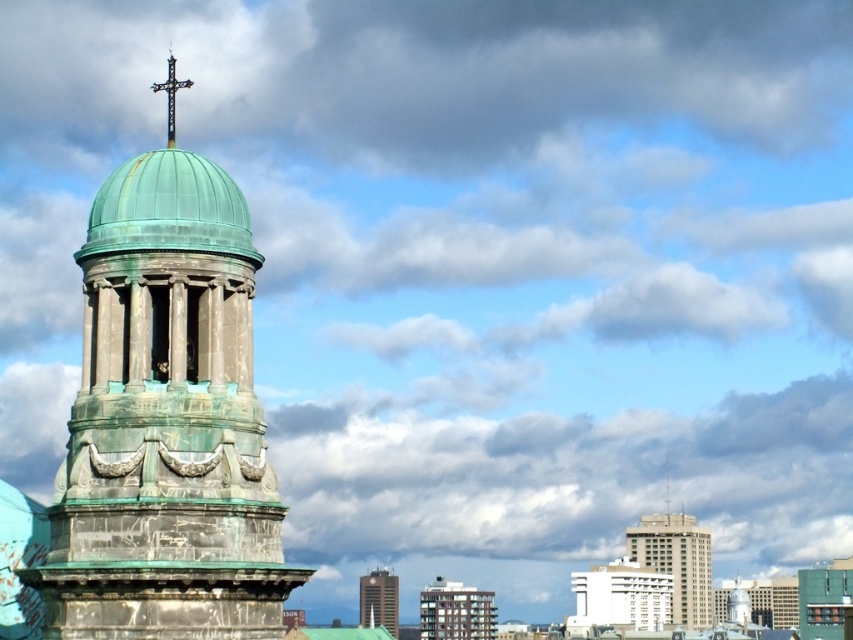
Is smooth concrete building at lower center further to camera compared to black metal cross at upper center?

Yes, it is.

Is point (447, 621) behind point (172, 131)?

That is True.

Which is behind, point (479, 605) or point (170, 54)?

Point (479, 605)

At what (x,y) coordinates should I click in order to perform the action: click on smooth concrete building at lower center. Please return your answer as a coordinate pair (x, y). Looking at the image, I should click on (456, 611).

Which is behind, point (230, 413) or point (170, 100)?

Point (170, 100)

Is green patina stone tower at left wider than black metal cross at upper center?

No.

What do you see at coordinates (166, 422) in the screenshot?
I see `green patina stone tower at left` at bounding box center [166, 422].

Find the location of a particular element. green patina stone tower at left is located at coordinates (166, 422).

Between white marble hotel at center and smooth concrete building at lower center, which one appears on the left side from the viewer's perspective?

Positioned to the left is smooth concrete building at lower center.

What do you see at coordinates (622, 595) in the screenshot? The width and height of the screenshot is (853, 640). I see `white marble hotel at center` at bounding box center [622, 595].

You are a GUI agent. You are given a task and a screenshot of the screen. Output one action in this format:
    pyautogui.click(x=<x>, y=<y>)
    Task: Click on the white marble hotel at center
    
    Given the screenshot: What is the action you would take?
    pyautogui.click(x=622, y=595)